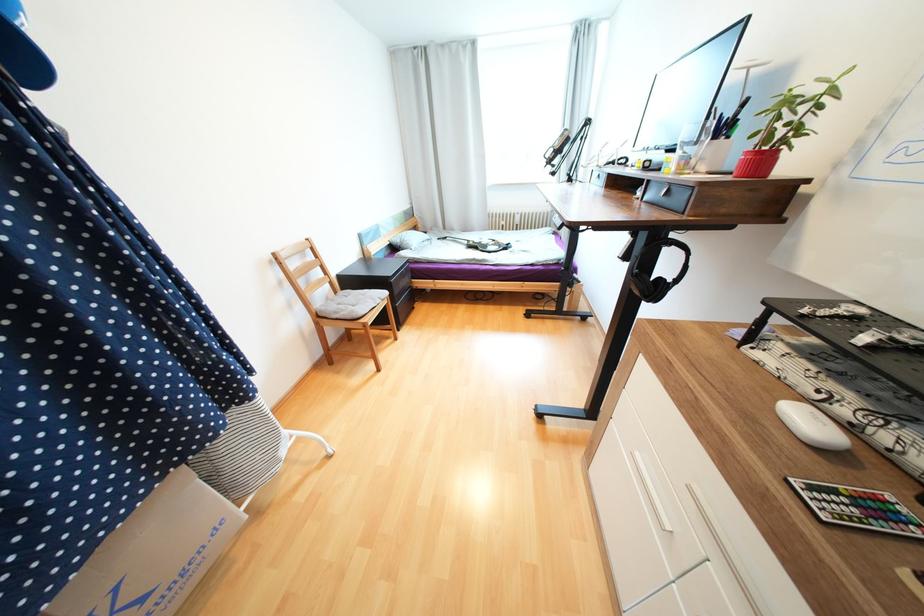
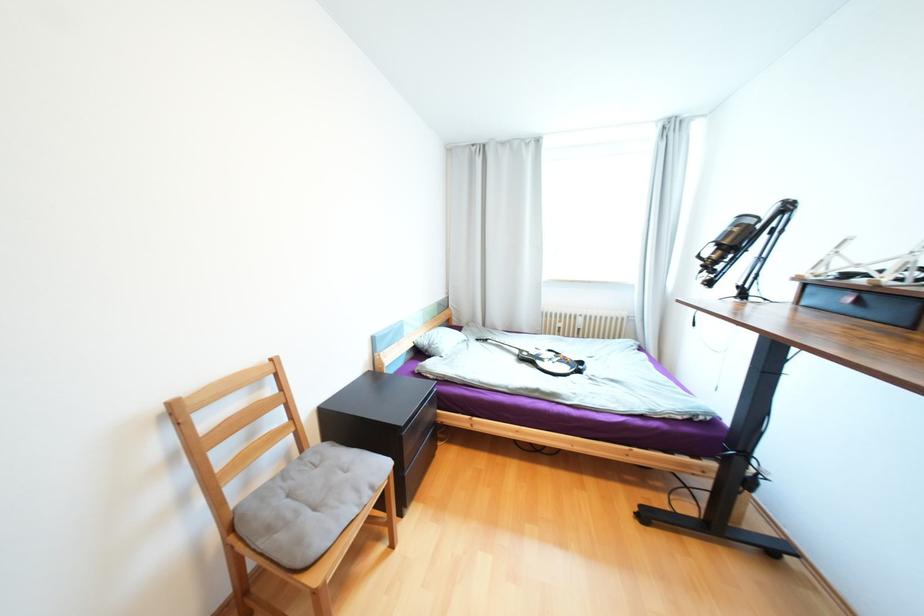
Question: The images are taken continuously from a first-person perspective. In which direction is your viewpoint rotating?

Choices:
 (A) Left
 (B) Right
 (C) Up
 (D) Down

Answer: (C)